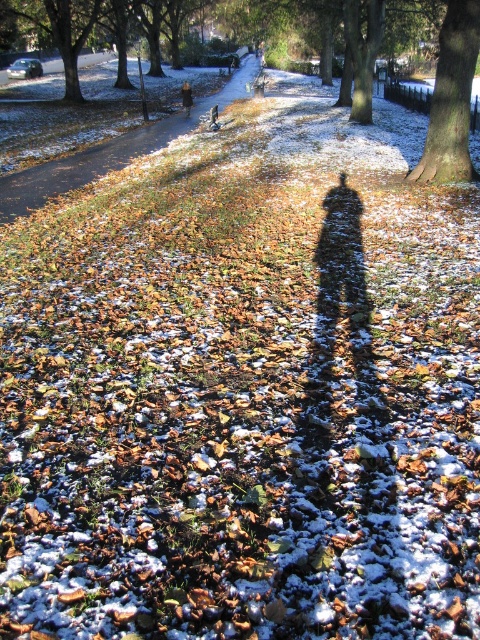
You are standing on the brown leafy path at center and want to reach the brown rough textured tree at center right. Which direction should you walk to get there?

You should walk to the right because the brown leafy path at center is to the left of the brown rough textured tree at center right.

You are planning to walk along the path in the winter scene. The brown leafy path at center and the brown rough textured tree at center right are both in your way. Which one do you need to walk around to continue forward?

The brown leafy path at center has a larger size compared to brown rough textured tree at center right, so you would need to walk around the brown rough textured tree at center right since it is smaller and likely easier to navigate around while staying on the path.

You are standing at the starting point of the path in the winter scene. The brown leafy path at center is at point 0.237, 0.229. If you walk straight ahead, will you stay on the path?

The brown leafy path at center is at point 0.229, so walking straight ahead would keep you on the path since it is centered.